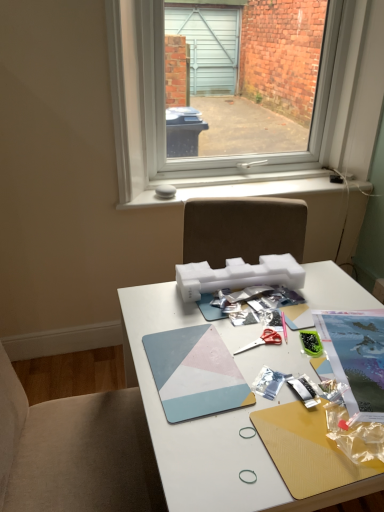
The image size is (384, 512). What are the coordinates of `free space in front of green plastic container at center-right` in the screenshot? It's located at (321, 392).